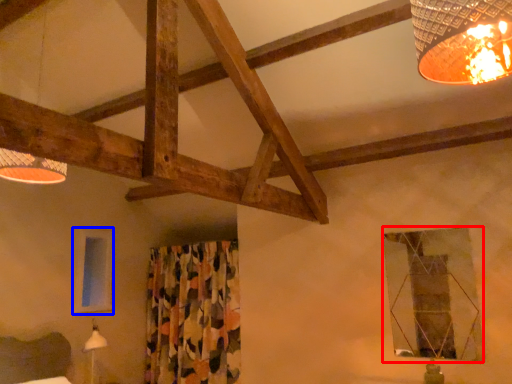
Question: Which object is closer to the camera taking this photo, window (highlighted by a red box) or window (highlighted by a blue box)?

Choices:
 (A) window
 (B) window

Answer: (A)